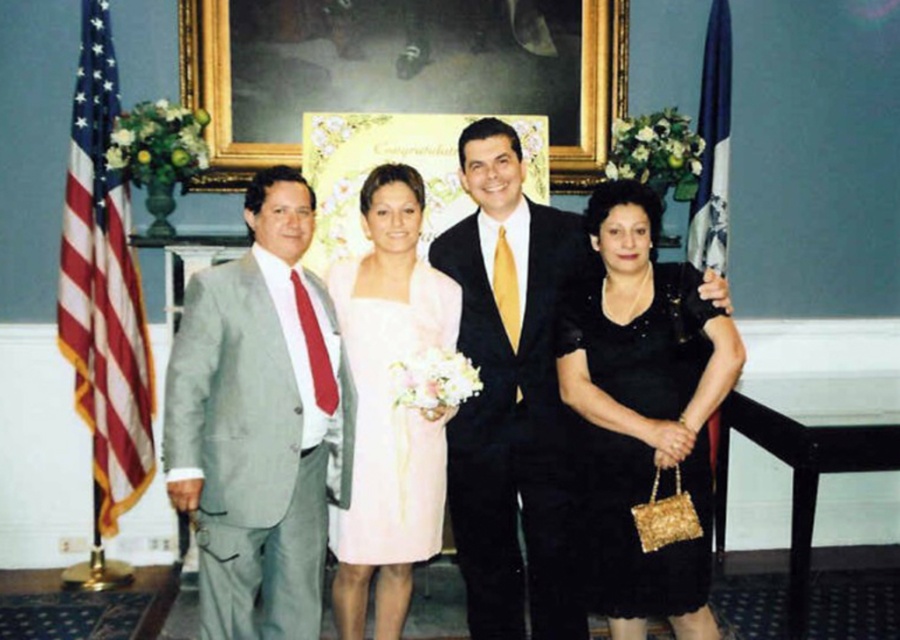
Can you confirm if light gray suit at left is positioned to the right of goldwooden frame at upper center?

Indeed, light gray suit at left is positioned on the right side of goldwooden frame at upper center.

From the picture: Does light gray suit at left have a smaller size compared to goldwooden frame at upper center?

Incorrect, light gray suit at left is not smaller in size than goldwooden frame at upper center.

This screenshot has width=900, height=640. I want to click on light gray suit at left, so click(x=259, y=422).

Does red-white striped fabric at left have a greater width compared to blue fabric flag at right?

Yes.

Which is above, red-white striped fabric at left or blue fabric flag at right?

blue fabric flag at right

Locate an element on the screen. The image size is (900, 640). red-white striped fabric at left is located at coordinates (104, 289).

Is point (500, 394) in front of point (716, 124)?

Yes, point (500, 394) is closer to viewer.

Who is more distant from viewer, (508, 484) or (723, 156)?

Positioned behind is point (723, 156).

The image size is (900, 640). What are the coordinates of `shiny black suit at center` in the screenshot? It's located at (510, 396).